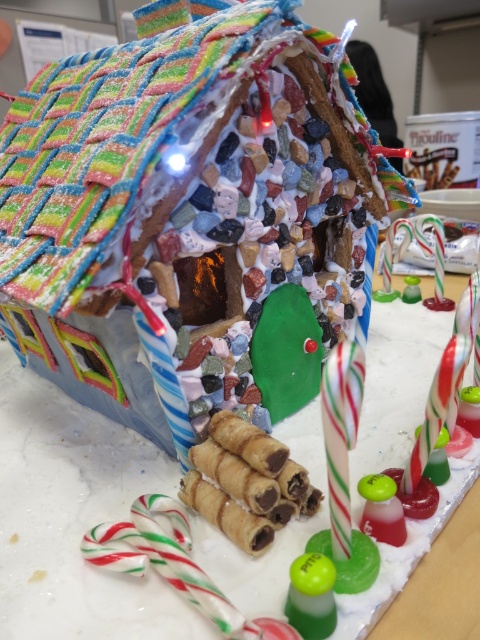
Question: Is candy-coated gingerbread house at center smaller than striped candy cane at center?

Choices:
 (A) no
 (B) yes

Answer: (A)

Question: Does candy-coated gingerbread house at center have a larger size compared to striped candy cane at center?

Choices:
 (A) yes
 (B) no

Answer: (A)

Question: Which of the following is the farthest from the observer?

Choices:
 (A) [343, 428]
 (B) [208, 150]

Answer: (B)

Question: Does candy-coated gingerbread house at center have a greater width compared to striped candy cane at center?

Choices:
 (A) yes
 (B) no

Answer: (A)